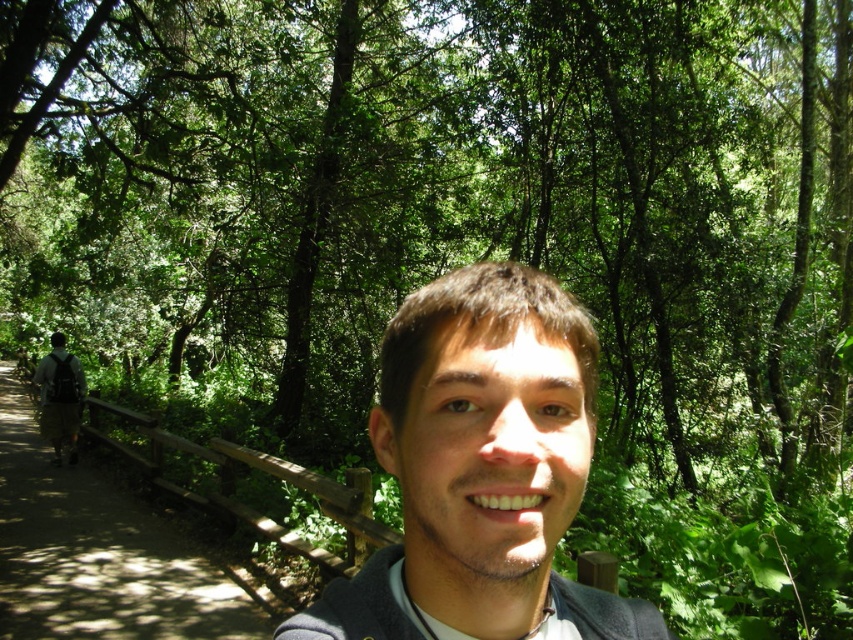
Can you confirm if smooth skin face at center is thinner than khaki pants at left?

Yes.

Is smooth skin face at center bigger than khaki pants at left?

Actually, smooth skin face at center might be smaller than khaki pants at left.

Does point (415, 429) lie in front of point (67, 424)?

Yes, point (415, 429) is in front of point (67, 424).

This screenshot has width=853, height=640. What are the coordinates of `smooth skin face at center` in the screenshot? It's located at [x=489, y=454].

Between brown hair at center and khaki pants at left, which one has more height?

Standing taller between the two is brown hair at center.

How distant is brown hair at center from khaki pants at left?

brown hair at center is 11.14 meters away from khaki pants at left.

Measure the distance between point [440,625] and camera.

Point [440,625] is 22.13 inches away from camera.

Locate an element on the screen. This screenshot has width=853, height=640. brown hair at center is located at coordinates (480, 468).

Between brown hair at center and brown wooden trail at left, which one is positioned lower?

brown wooden trail at left

Is point (490, 467) in front of point (85, 602)?

Yes.

Who is more forward, [383,429] or [209,560]?

Point [383,429] is in front.

This screenshot has width=853, height=640. Identify the location of brown hair at center. (480, 468).